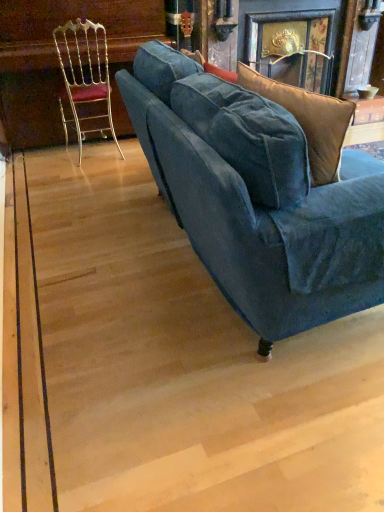
Question: Does wooden table at upper right have a larger size compared to velvet blue couch at center?

Choices:
 (A) no
 (B) yes

Answer: (A)

Question: Are wooden table at upper right and velvet blue couch at center located far from each other?

Choices:
 (A) no
 (B) yes

Answer: (B)

Question: Can you confirm if wooden table at upper right is shorter than velvet blue couch at center?

Choices:
 (A) yes
 (B) no

Answer: (A)

Question: From the image's perspective, would you say wooden table at upper right is positioned over velvet blue couch at center?

Choices:
 (A) no
 (B) yes

Answer: (B)

Question: From a real-world perspective, is wooden table at upper right below velvet blue couch at center?

Choices:
 (A) no
 (B) yes

Answer: (B)

Question: Based on their sizes in the image, would you say wooden table at upper right is bigger or smaller than gold metallic chair at left?

Choices:
 (A) big
 (B) small

Answer: (B)

Question: From a real-world perspective, is wooden table at upper right above or below gold metallic chair at left?

Choices:
 (A) above
 (B) below

Answer: (B)

Question: Considering their positions, is wooden table at upper right located in front of or behind gold metallic chair at left?

Choices:
 (A) front
 (B) behind

Answer: (B)

Question: From the image's perspective, is wooden table at upper right above or below gold metallic chair at left?

Choices:
 (A) below
 (B) above

Answer: (B)

Question: Considering the positions of point (218, 194) and point (72, 81), is point (218, 194) closer or farther from the camera than point (72, 81)?

Choices:
 (A) closer
 (B) farther

Answer: (A)

Question: Looking at the image, does velvet blue couch at center seem bigger or smaller compared to gold metallic chair at left?

Choices:
 (A) big
 (B) small

Answer: (A)

Question: In terms of width, does velvet blue couch at center look wider or thinner when compared to gold metallic chair at left?

Choices:
 (A) thin
 (B) wide

Answer: (B)

Question: Visually, is velvet blue couch at center positioned to the left or to the right of gold metallic chair at left?

Choices:
 (A) right
 (B) left

Answer: (A)

Question: From a real-world perspective, is gold metallic chair at left positioned above or below wooden table at upper right?

Choices:
 (A) below
 (B) above

Answer: (B)

Question: In the image, is gold metallic chair at left on the left side or the right side of wooden table at upper right?

Choices:
 (A) right
 (B) left

Answer: (B)